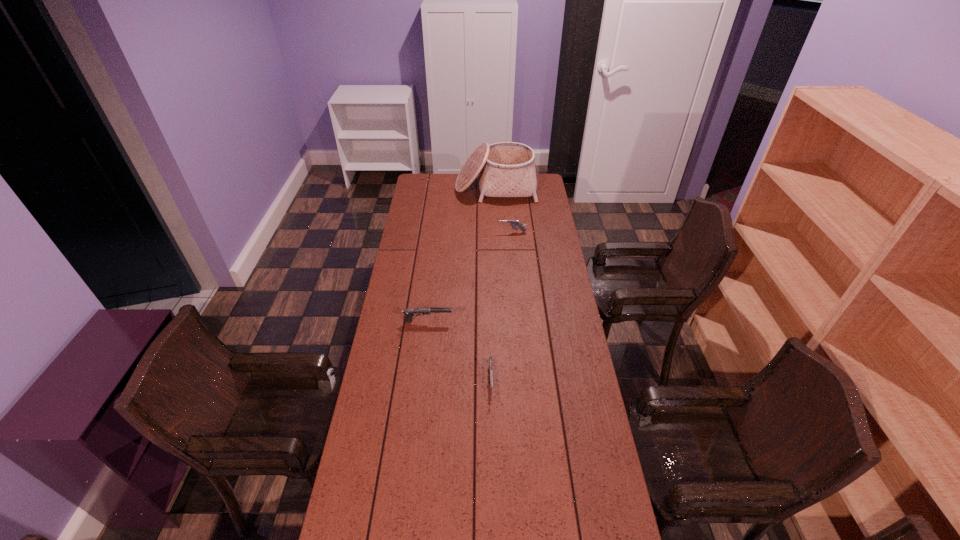
This screenshot has height=540, width=960. I want to click on free space between the second gun from left to right and the basket, so click(493, 286).

You are a GUI agent. You are given a task and a screenshot of the screen. Output one action in this format:
    pyautogui.click(x=<x>, y=<y>)
    Task: Click on the vacant area between the farthest object and the shortest object
    This screenshot has width=960, height=540.
    Given the screenshot: What is the action you would take?
    pyautogui.click(x=493, y=286)

Locate which object is the third closest to the tallest object. Please provide its 2D coordinates. Your answer should be formatted as a tuple, i.e. [(x, y)], where the tuple contains the x and y coordinates of a point satisfying the conditions above.

[(490, 358)]

You are a GUI agent. You are given a task and a screenshot of the screen. Output one action in this format:
    pyautogui.click(x=<x>, y=<y>)
    Task: Click on the object that stands as the third closest to the farthest gun
    The image size is (960, 540).
    Given the screenshot: What is the action you would take?
    pyautogui.click(x=490, y=358)

Find the location of a particular element. This screenshot has width=960, height=540. gun that can be found as the closest to the leftmost gun is located at coordinates (490, 358).

At what (x,y) coordinates should I click in order to perform the action: click on gun object that ranks as the closest to the second farthest gun. Please return your answer as a coordinate pair (x, y). Image resolution: width=960 pixels, height=540 pixels. Looking at the image, I should click on (490, 358).

Where is `vacant space that satisfies the following two spatial constraints: 1. at the barrel of the third nearest object; 2. aimed along the barrel of the shortest object`? vacant space that satisfies the following two spatial constraints: 1. at the barrel of the third nearest object; 2. aimed along the barrel of the shortest object is located at coordinates (525, 384).

I want to click on free space that satisfies the following two spatial constraints: 1. with the lid open on the basket; 2. at the muzzle end of the third farthest object, so click(x=502, y=321).